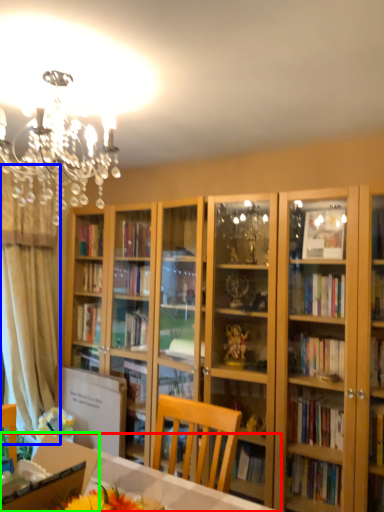
Question: Which is farther away from desk (highlighted by a red box)? curtain (highlighted by a blue box) or cardboard box (highlighted by a green box)?

Choices:
 (A) curtain
 (B) cardboard box

Answer: (A)